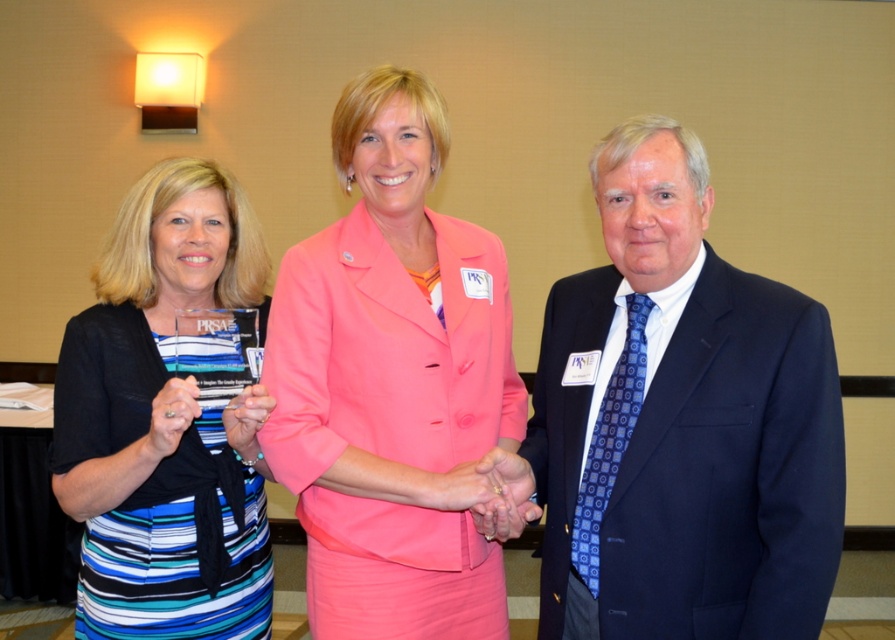
Can you confirm if navy blue suit at center is wider than striped fabric dress at center?

Correct, the width of navy blue suit at center exceeds that of striped fabric dress at center.

Who is higher up, navy blue suit at center or striped fabric dress at center?

navy blue suit at center is above.

This screenshot has height=640, width=895. Describe the element at coordinates (680, 422) in the screenshot. I see `navy blue suit at center` at that location.

Locate an element on the screen. This screenshot has height=640, width=895. navy blue suit at center is located at coordinates (680, 422).

Does navy blue suit at center have a smaller size compared to pink fabric jacket at center?

Yes.

Does navy blue suit at center have a greater width compared to pink fabric jacket at center?

Yes.

Where is `navy blue suit at center`? The height and width of the screenshot is (640, 895). navy blue suit at center is located at coordinates (680, 422).

Find the location of a particular element. The height and width of the screenshot is (640, 895). navy blue suit at center is located at coordinates (680, 422).

Can you confirm if pink fabric jacket at center is thinner than striped fabric dress at center?

Yes, pink fabric jacket at center is thinner than striped fabric dress at center.

Does pink fabric jacket at center have a larger size compared to striped fabric dress at center?

Incorrect, pink fabric jacket at center is not larger than striped fabric dress at center.

Does point (371, 212) lie behind point (95, 609)?

No, (371, 212) is in front of (95, 609).

Where is `pink fabric jacket at center`? This screenshot has height=640, width=895. pink fabric jacket at center is located at coordinates (394, 385).